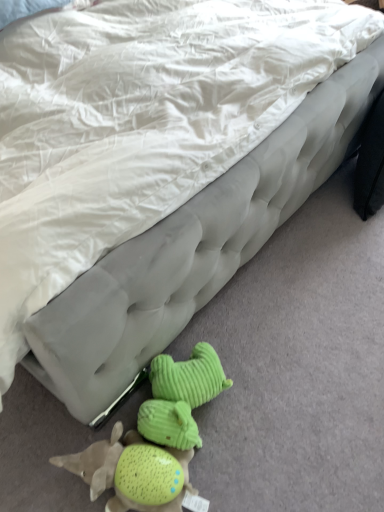
Identify the location of spots to the right of green corduroy plush at lower left. (245, 455).